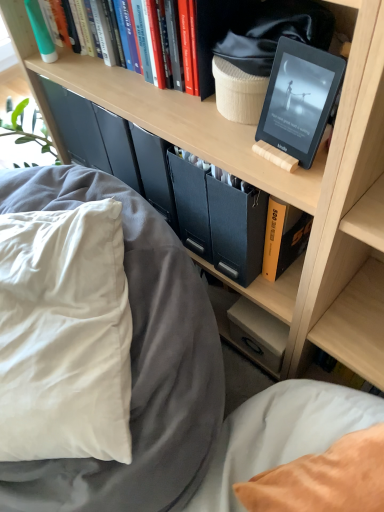
Question: In terms of width, does white soft pillow at left look wider or thinner when compared to yellow hardcover book at center, the fourth book in the top-to-bottom sequence?

Choices:
 (A) wide
 (B) thin

Answer: (A)

Question: Is white soft pillow at left in front of or behind yellow hardcover book at center, which ranks as the 1th book in bottom-to-top order, in the image?

Choices:
 (A) front
 (B) behind

Answer: (A)

Question: Which object is the farthest from the black matte tablet at upper right?

Choices:
 (A) wooden kindle at center, the 3th book when ordered from top to bottom
 (B) soft gray fabric bed at lower left
 (C) white soft pillow at left
 (D) green matte toothpaste tube at upper left, acting as the fourth book starting from the right
 (E) yellow hardcover book at center, the fourth book in the top-to-bottom sequence

Answer: (D)

Question: Which of these objects is positioned farthest from the orange matte book at center?

Choices:
 (A) white soft pillow at left
 (B) yellow hardcover book at center, the fourth book in the top-to-bottom sequence
 (C) black matte tablet at upper right
 (D) wooden kindle at center, arranged as the 3th book when viewed from the left
 (E) soft gray fabric bed at lower left

Answer: (A)